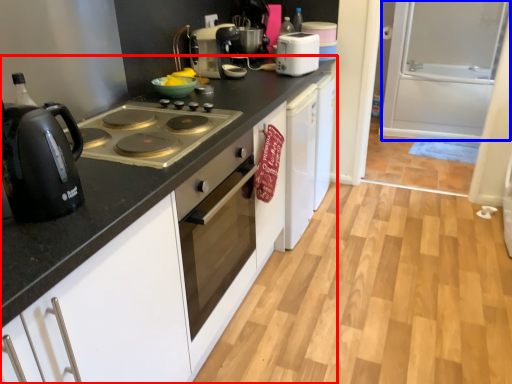
Question: Which object is further to the camera taking this photo, countertop (highlighted by a red box) or screen door (highlighted by a blue box)?

Choices:
 (A) countertop
 (B) screen door

Answer: (B)